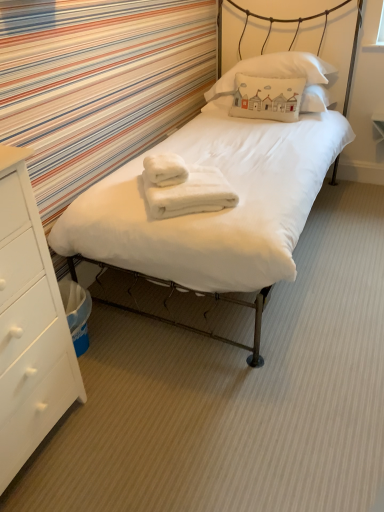
Find the location of a particular element. vacant space that is in between white wood chest of drawers at lower left and white matte bed at center is located at coordinates (152, 394).